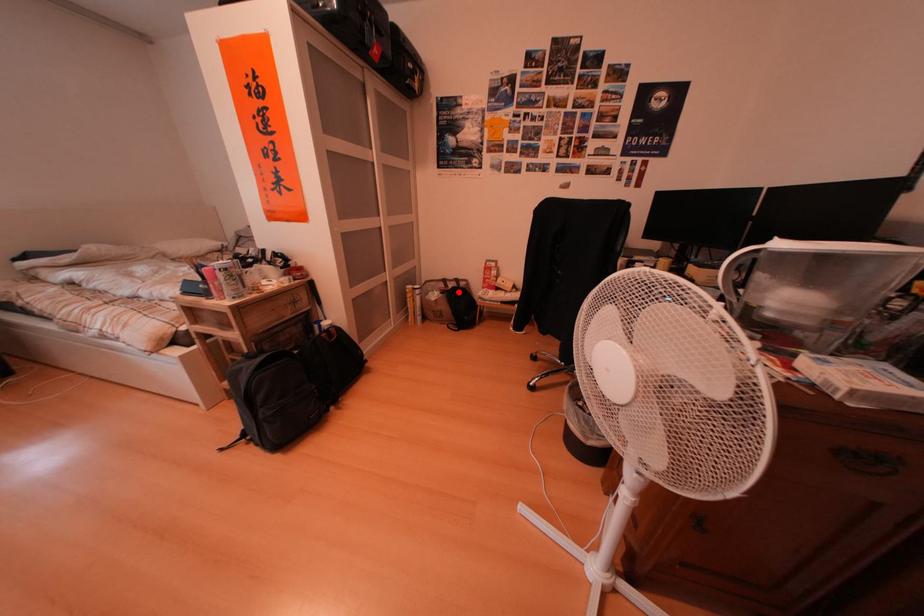
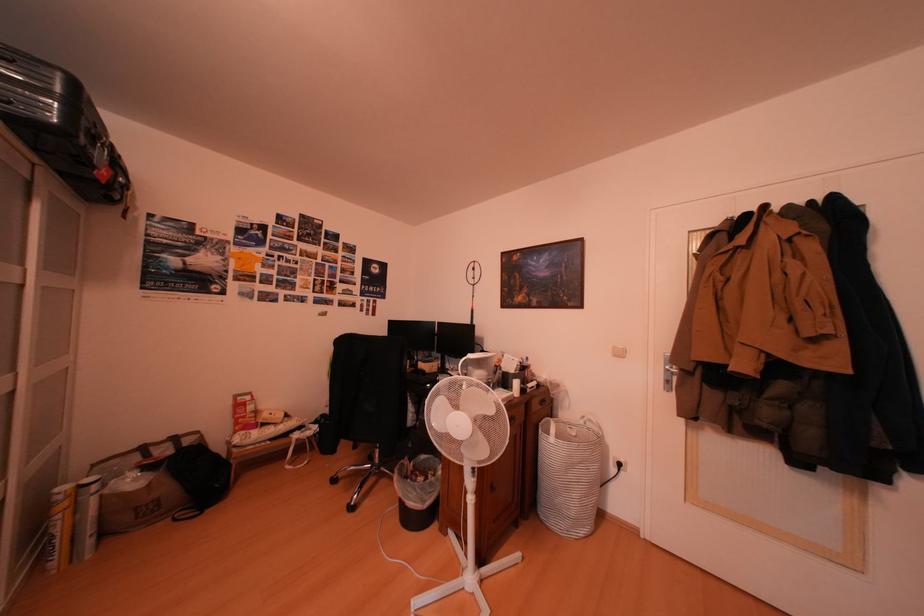
Question: I am providing you with two images of the same scene from different viewpoints. A red point is shown in image1. For the corresponding object point in image2, is it positioned nearer or farther from the camera?

Choices:
 (A) Nearer
 (B) Farther

Answer: (A)